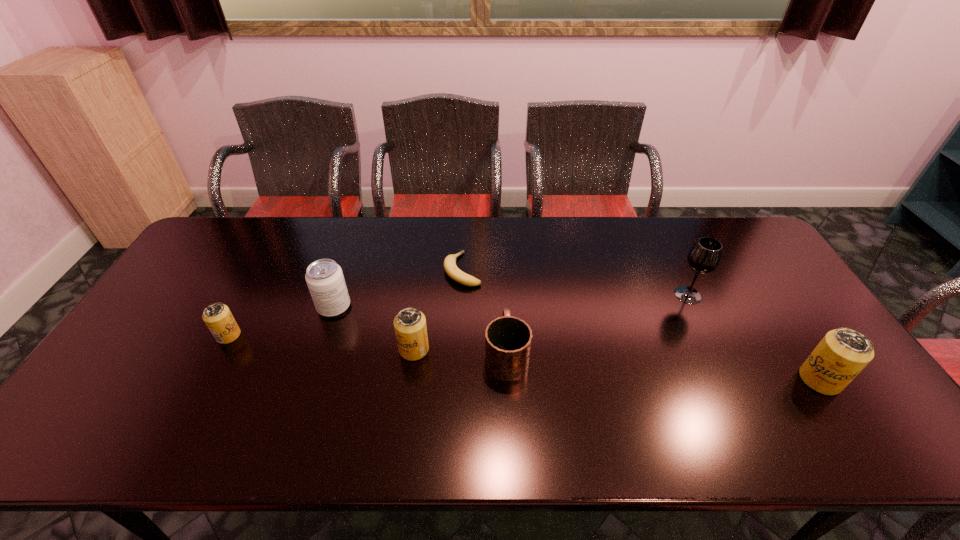
Locate an element on the screen. This screenshot has width=960, height=540. banana is located at coordinates coord(452,270).

Image resolution: width=960 pixels, height=540 pixels. Identify the location of mug. (508, 339).

Where is `free space located 0.190m on the front of the leftmost beer can`? The image size is (960, 540). free space located 0.190m on the front of the leftmost beer can is located at coordinates (190, 407).

The image size is (960, 540). What are the coordinates of `blank space located 0.150m on the front of the second shortest beer can` in the screenshot? It's located at 405,414.

Locate an element on the screen. This screenshot has width=960, height=540. blank area located on the back of the rightmost object is located at coordinates (784, 326).

Image resolution: width=960 pixels, height=540 pixels. Find the location of `free space located on the left of the sixth object from left to right`. free space located on the left of the sixth object from left to right is located at coordinates (591, 295).

You are a GUI agent. You are given a task and a screenshot of the screen. Output one action in this format:
    pyautogui.click(x=<x>, y=<y>)
    Task: Click on the vacant space located 0.080m on the left of the second object from left to right
    This screenshot has height=540, width=960.
    Given the screenshot: What is the action you would take?
    [290, 307]

The height and width of the screenshot is (540, 960). I want to click on blank space located 0.250m on the front of the banana, so click(x=459, y=354).

Image resolution: width=960 pixels, height=540 pixels. Identify the location of vacant space located 0.190m on the side of the mug with the handle. (502, 281).

Identify the location of free spot located on the side of the mug with the handle. (501, 254).